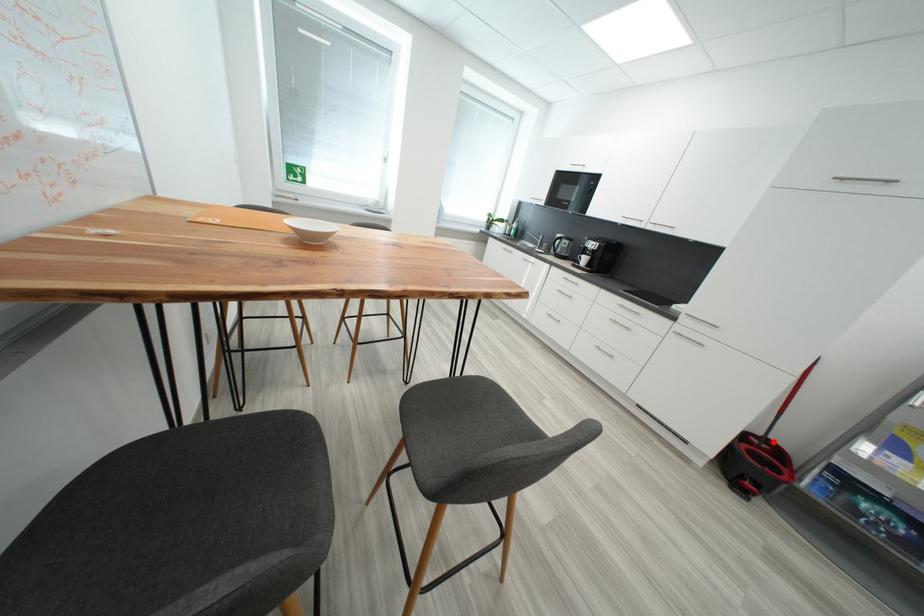
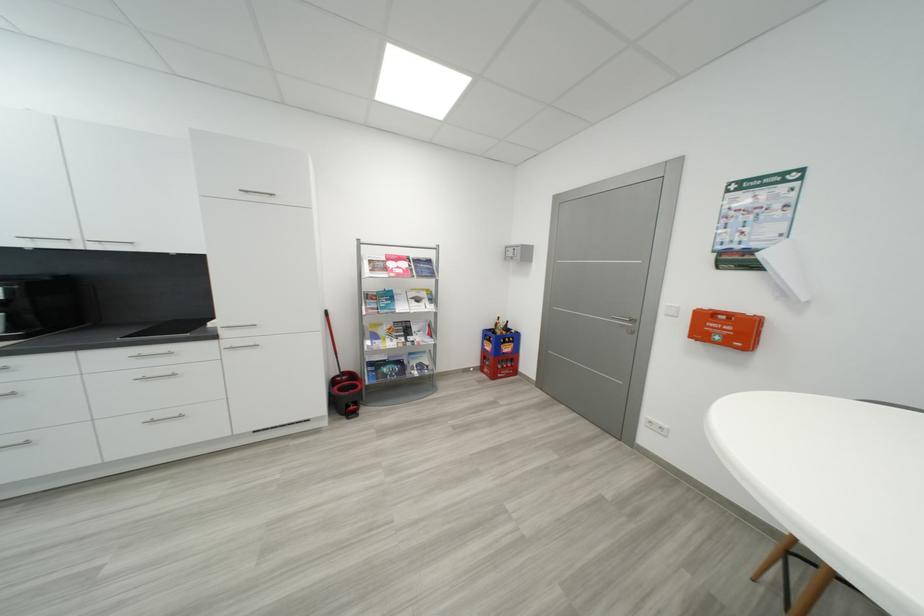
Question: A red point is marked in image1. In image2, is the corresponding 3D point closer to the camera or farther? Reply with the corresponding letter.

Choices:
 (A) The corresponding 3D point is closer.
 (B) The corresponding 3D point is farther.

Answer: (B)